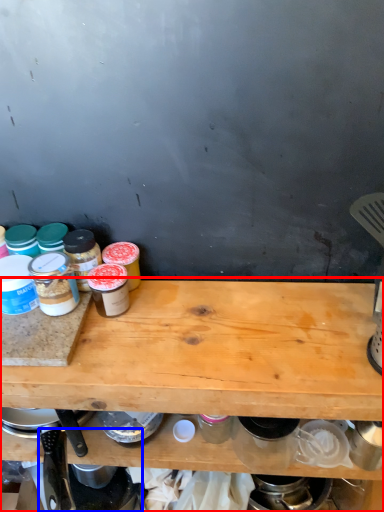
Question: Which object appears closest to the camera in this image, table (highlighted by a red box) or appliance (highlighted by a blue box)?

Choices:
 (A) table
 (B) appliance

Answer: (A)